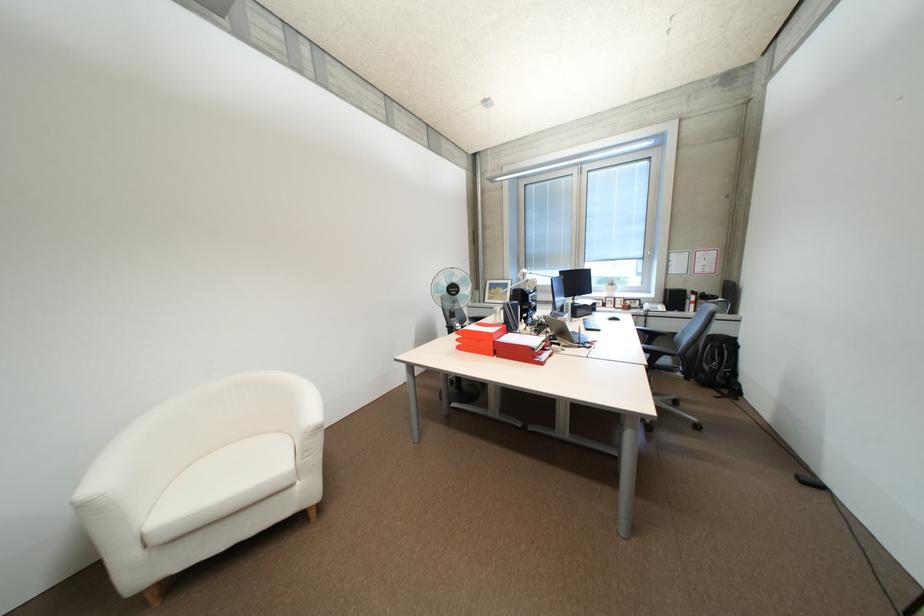
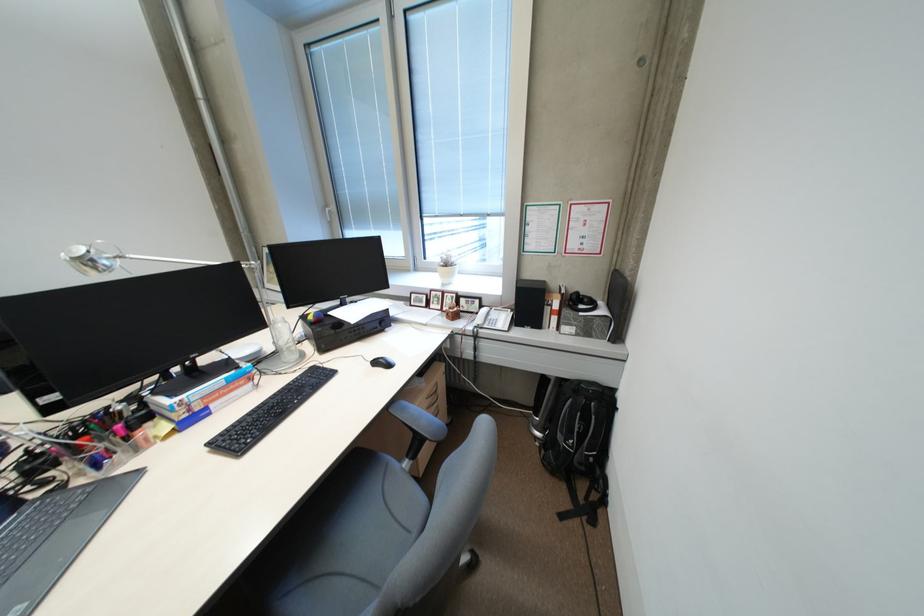
The point at [726,394] is marked in the first image. Where is the corresponding point in the second image?

(576, 501)